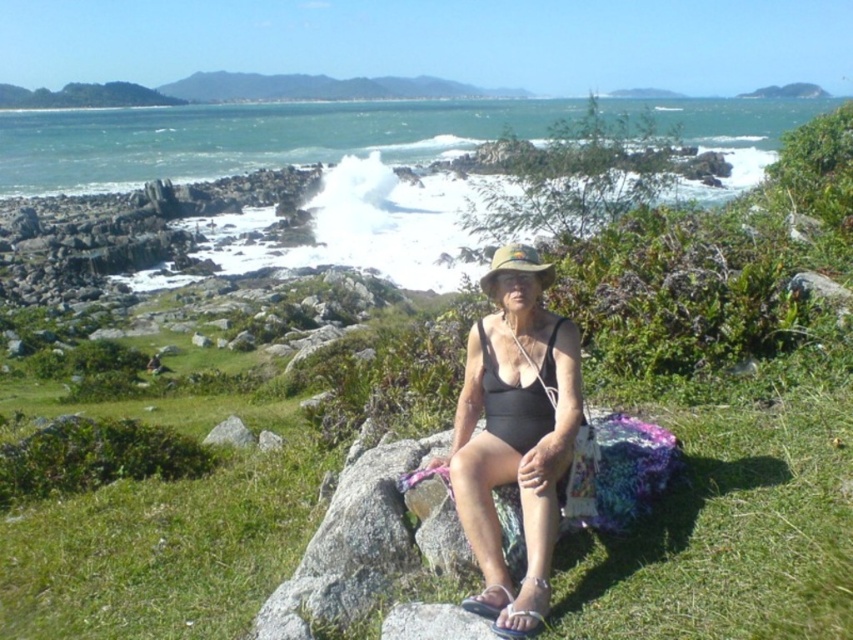
You are a photographer trying to capture the black matte bikini top at center and the gray rock at center in a single frame. Given that your camera can only focus on objects wider than 1 meter, will both objects be in focus?

The black matte bikini top at center has a width less than 1 meter since it is narrower than the gray rock at center. The gray rock at center might be wider than 1 meter, but the camera requires both objects to be wider than 1 meter to be in focus. Therefore, the black matte bikini top at center may not meet the width requirement, so both objects might not be in focus.

You are a photographer trying to capture the person and their belongings in the scene. You want to ensure that both the green fabric hat at center and the gray rock at center are clearly visible in your shot. Given their sizes, which object should you focus on first to ensure proper framing?

The green fabric hat at center is smaller than the gray rock at center, so you should focus on the gray rock at center first to ensure it is properly framed, as it is larger and might require more attention to capture its details.

You are a photographer trying to capture the person in the matte black swimsuit at center and the gray rock at center in a single frame. Since the camera has a fixed focal length, you need to know which object is narrower to position yourself correctly. Which one has a smaller width?

The matte black swimsuit at center has a lesser width compared to the gray rock at center, so it is narrower and you should position yourself closer to the matte black swimsuit at center to include both in the frame.